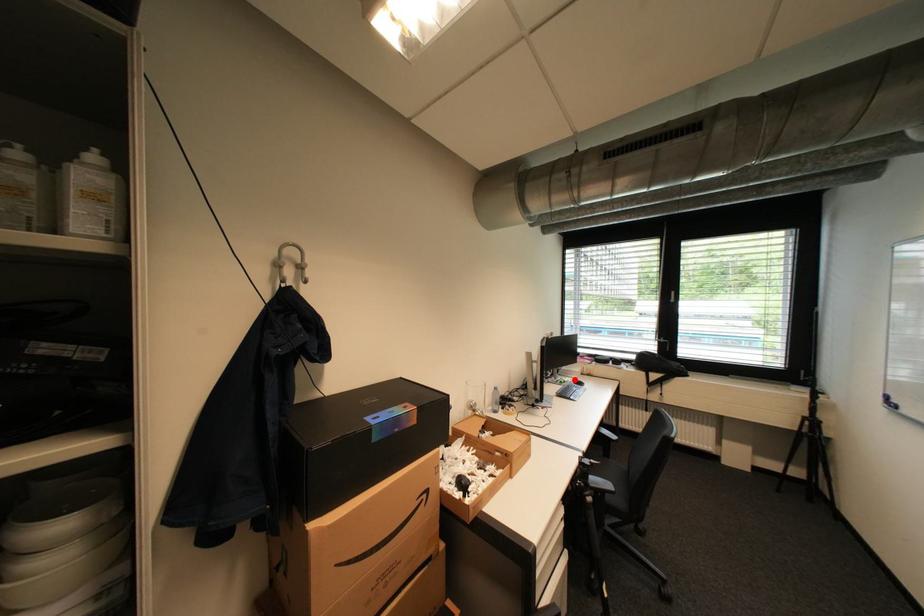
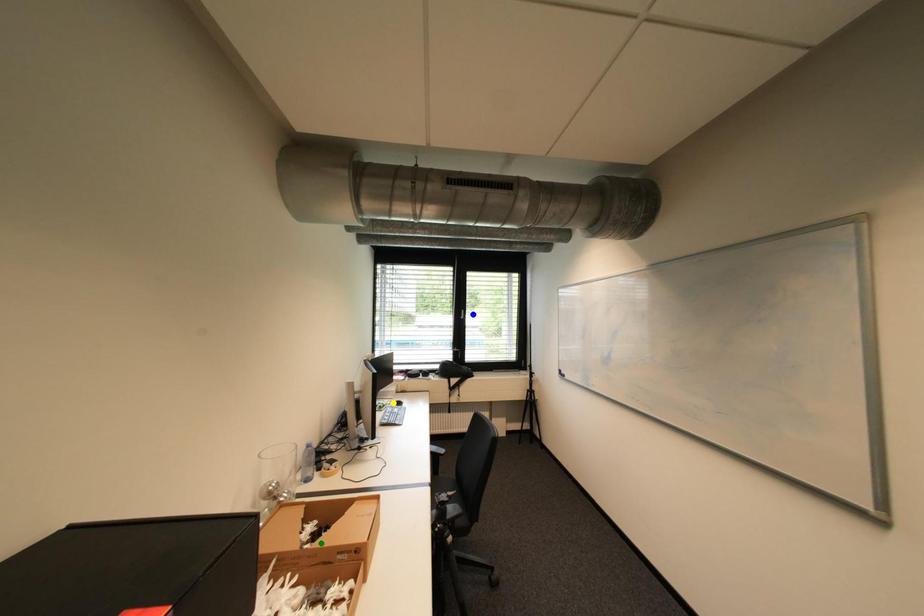
Question: I am providing you with two images of the same scene from different viewpoints. A red point is marked on the first image. You are given multiple points on the second image. In image 2, which mark is for the same physical point as the one in image 1?

Choices:
 (A) blue point
 (B) green point
 (C) yellow point

Answer: (C)